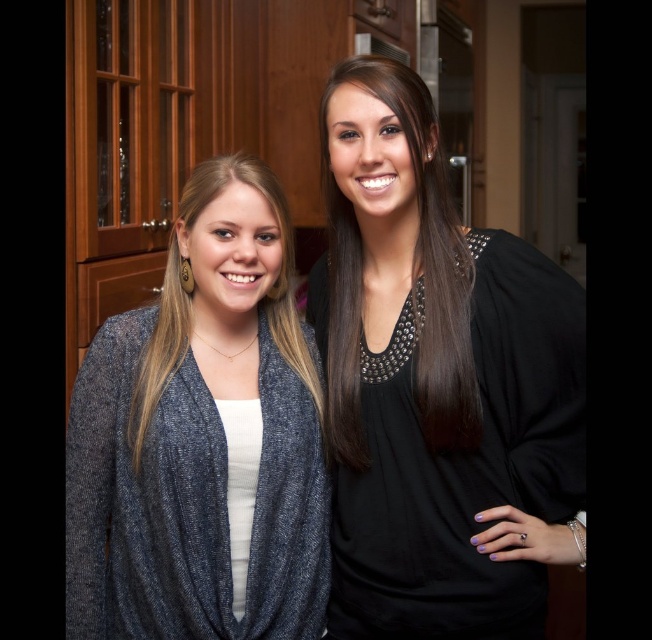
You are organizing a clothing rack and need to arrange the black matte blouse at center and the black studded top at center vertically. According to the image, which one should be placed higher on the rack?

The black studded top at center should be placed higher on the rack because in the image, the black matte blouse at center is positioned below the black studded top at center.

You are standing in a kitchen and see two people. The first person is wearing a dark gray cardigan on the left, and the second person has a black top with decorative embellishments on the right. There is a specific point marked at coordinates (201, 440). Which piece of clothing is this point located on?

The point at (201, 440) is located on the knit cardigan at left.

You are designing a display for a clothing store and need to arrange two garments side by side. The knit cardigan at left and the black studded top at center must be placed on a mannequin. Given that the mannequin has limited vertical space, which garment should be placed lower to ensure both fit within the display area?

The black studded top at center should be placed lower because the knit cardigan at left is taller, allowing the shorter black studded top at center to occupy less vertical space at the bottom.